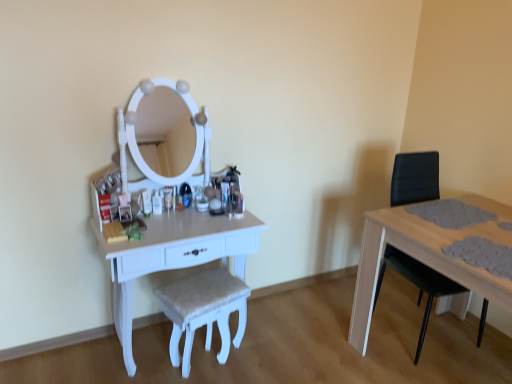
You are a GUI agent. You are given a task and a screenshot of the screen. Output one action in this format:
    pyautogui.click(x=<x>, y=<y>)
    Task: Click on the unoccupied region to the right of white glossy table at left
    Image resolution: width=512 pixels, height=384 pixels.
    Given the screenshot: What is the action you would take?
    click(x=291, y=337)